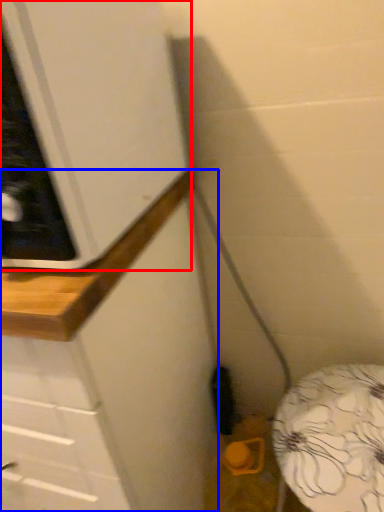
Question: Which object is closer to the camera taking this photo, cabinetry (highlighted by a red box) or counter (highlighted by a blue box)?

Choices:
 (A) cabinetry
 (B) counter

Answer: (A)